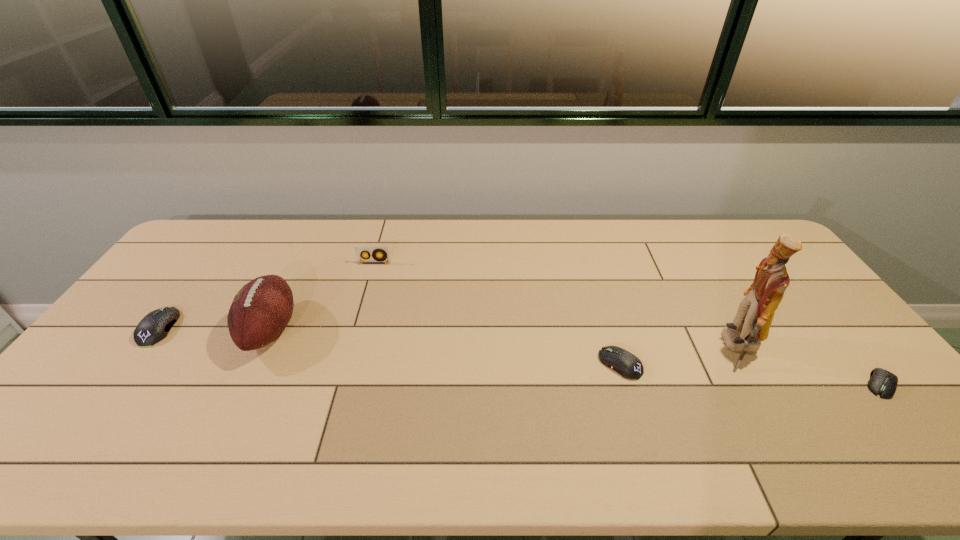
This screenshot has width=960, height=540. I want to click on object that is positioned at the near edge, so click(x=882, y=382).

I want to click on object located in the left edge section of the desktop, so click(154, 327).

Find the location of a particular element. The width and height of the screenshot is (960, 540). object at the right edge is located at coordinates (882, 382).

At what (x,y) coordinates should I click in order to perform the action: click on object present at the near right corner. Please return your answer as a coordinate pair (x, y). This screenshot has height=540, width=960. Looking at the image, I should click on (882, 382).

Find the location of a particular element. The width and height of the screenshot is (960, 540). vacant space at the far edge is located at coordinates (420, 227).

In the image, there is a desktop. What are the coordinates of `vacant space at the near edge` in the screenshot? It's located at (470, 417).

You are a GUI agent. You are given a task and a screenshot of the screen. Output one action in this format:
    pyautogui.click(x=<x>, y=<y>)
    Task: Click on the free space at the left edge of the desktop
    The image size is (960, 540).
    Given the screenshot: What is the action you would take?
    pyautogui.click(x=131, y=353)

In the image, there is a desktop. At what (x,y) coordinates should I click in order to perform the action: click on free space at the right edge. Please return your answer as a coordinate pair (x, y). Image resolution: width=960 pixels, height=540 pixels. Looking at the image, I should click on (823, 312).

What are the coordinates of `empty space between the fourth shortest object and the second tallest object` in the screenshot? It's located at (323, 296).

Where is `free space between the second computer equipment from right to left and the football (American)`? The width and height of the screenshot is (960, 540). free space between the second computer equipment from right to left and the football (American) is located at coordinates (445, 347).